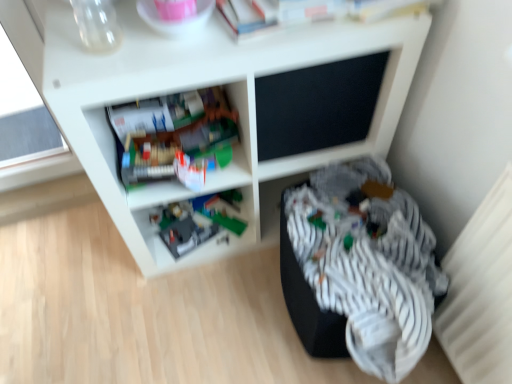
Question: Is striped fabric at lower right bigger than plastic gray toy at lower center, positioned as the first shelf in back-to-front order?

Choices:
 (A) no
 (B) yes

Answer: (B)

Question: Is plastic gray toy at lower center, positioned as the first shelf in back-to-front order, completely or partially inside striped fabric at lower right?

Choices:
 (A) yes
 (B) no

Answer: (B)

Question: Is striped fabric at lower right looking in the opposite direction of plastic gray toy at lower center, positioned as the first shelf in back-to-front order?

Choices:
 (A) yes
 (B) no

Answer: (B)

Question: From the image's perspective, does striped fabric at lower right appear higher than plastic gray toy at lower center, positioned as the first shelf in back-to-front order?

Choices:
 (A) no
 (B) yes

Answer: (A)

Question: Would you say striped fabric at lower right is a long distance from plastic gray toy at lower center, the 2th shelf from the front?

Choices:
 (A) no
 (B) yes

Answer: (A)

Question: Can you confirm if striped fabric at lower right is wider than plastic gray toy at lower center, positioned as the first shelf in back-to-front order?

Choices:
 (A) yes
 (B) no

Answer: (A)

Question: From the image's perspective, is white matte shelf at center, arranged as the 1th shelf when viewed from the front, over striped fabric at lower right?

Choices:
 (A) yes
 (B) no

Answer: (A)

Question: From a real-world perspective, does white matte shelf at center, arranged as the 1th shelf when viewed from the front, stand above striped fabric at lower right?

Choices:
 (A) no
 (B) yes

Answer: (B)

Question: Does white matte shelf at center, arranged as the 1th shelf when viewed from the front, have a greater height compared to striped fabric at lower right?

Choices:
 (A) yes
 (B) no

Answer: (A)

Question: Is white matte shelf at center, which appears as the second shelf when viewed from the back, completely or partially outside of striped fabric at lower right?

Choices:
 (A) yes
 (B) no

Answer: (A)

Question: Is white matte shelf at center, which appears as the second shelf when viewed from the back, aimed at striped fabric at lower right?

Choices:
 (A) no
 (B) yes

Answer: (B)

Question: Can you confirm if white matte shelf at center, which appears as the second shelf when viewed from the back, is wider than striped fabric at lower right?

Choices:
 (A) yes
 (B) no

Answer: (B)

Question: Could you tell me if white matte shelf at center, which appears as the second shelf when viewed from the back, is facing plastic gray toy at lower center, positioned as the first shelf in back-to-front order?

Choices:
 (A) yes
 (B) no

Answer: (B)